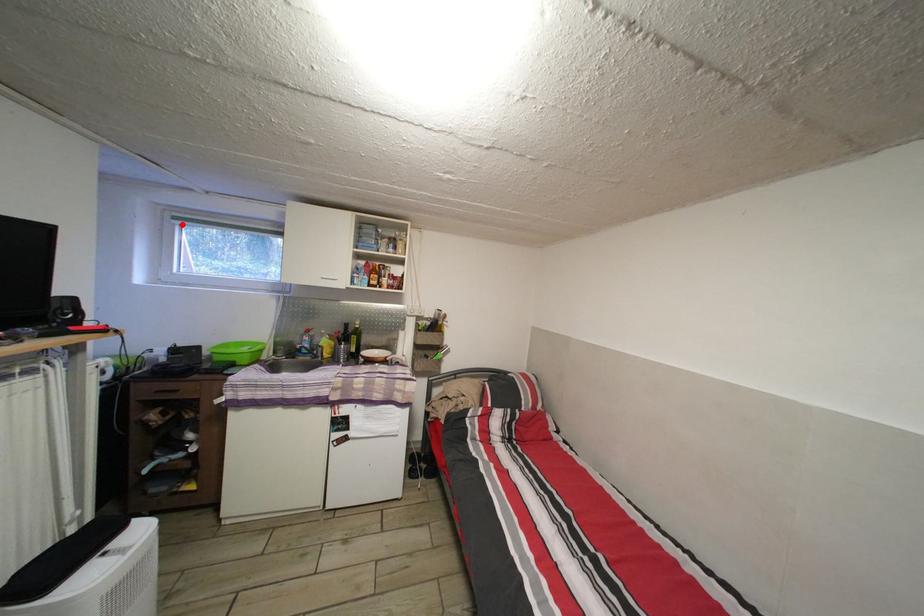
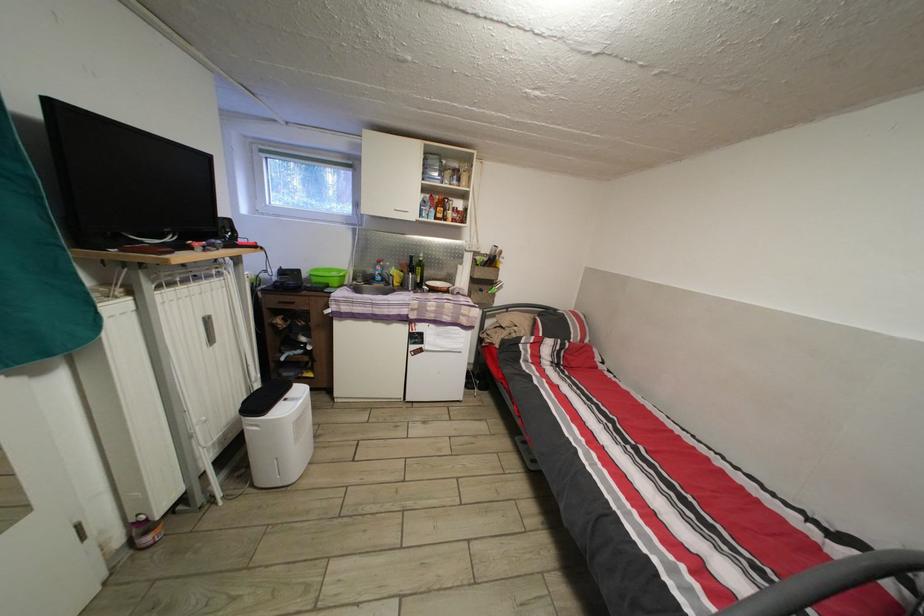
In the second image, find the point that corresponds to the highlighted location in the first image.

(269, 156)